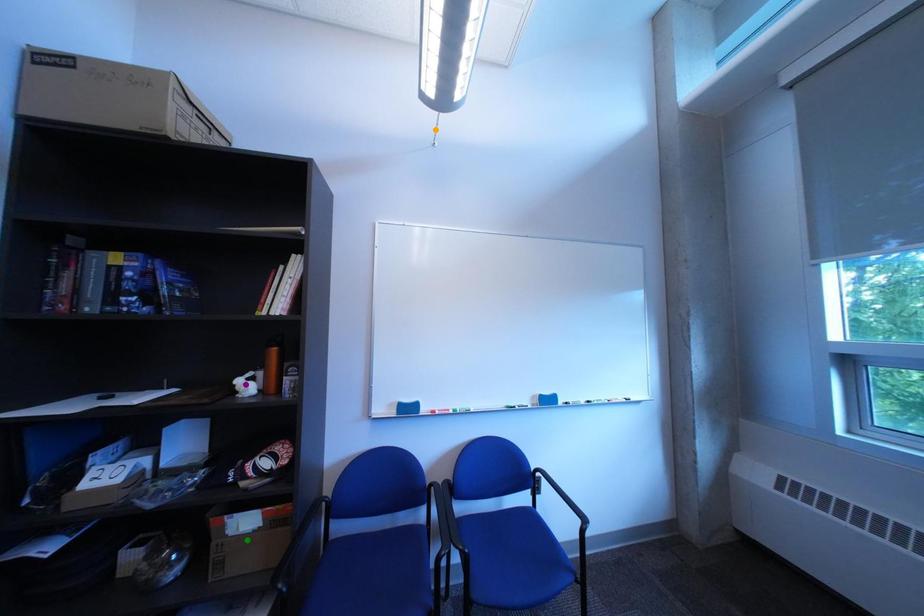
Order these from nearest to farthest:
- green point
- purple point
- orange point

green point → purple point → orange point